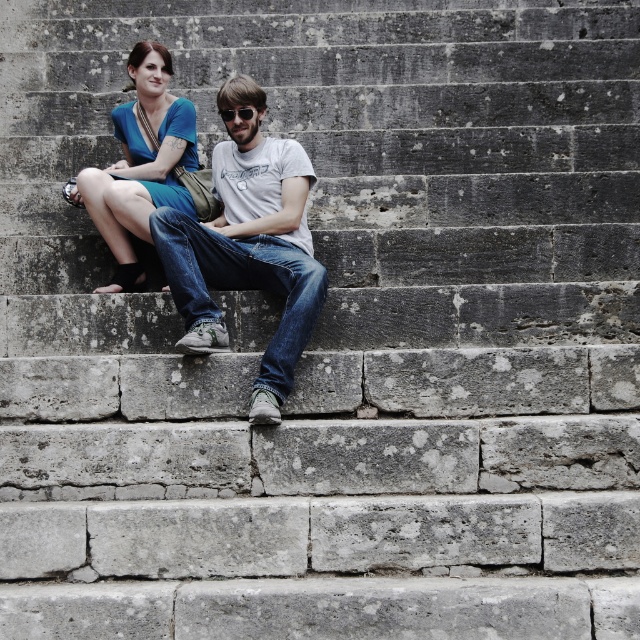
You are a photographer trying to capture both the denim jeans at center and the black matte sunglasses at center in a single frame. Given their sizes, which object should you focus on first to ensure both are clearly visible in the photo?

Since the denim jeans at center is larger in size than the black matte sunglasses at center, you should focus on the denim jeans at center first to ensure both are clearly visible in the photo.

You are standing in front of the stone steps where two people are sitting. You want to place a small potted plant exactly at the point marked by the coordinates point (248, 248). What object will the plant be placed on?

The point (248, 248) corresponds to the denim jeans at center, so the plant will be placed on the denim jeans at center.

You are a photographer trying to capture both the denim jeans at center and the black matte sunglasses at center in a single frame. Based on their sizes, which object should you focus on to ensure both fit in the frame without cropping?

The denim jeans at center might be wider than the black matte sunglasses at center, so focusing on the denim jeans at center would ensure both fit in the frame since it is the wider object.